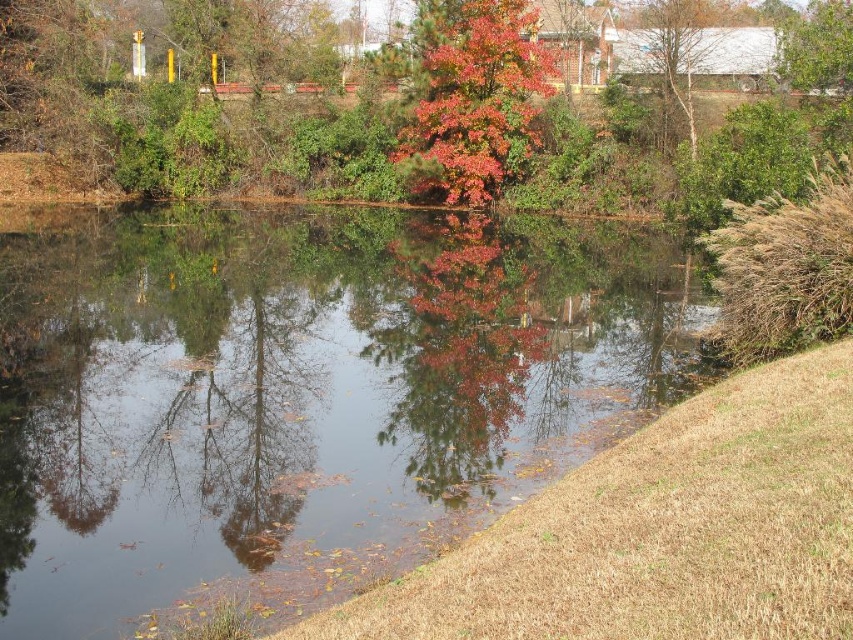
Is shiny red leaves at center shorter than bare branches at upper right?

Yes, shiny red leaves at center is shorter than bare branches at upper right.

Can you confirm if shiny red leaves at center is bigger than bare branches at upper right?

Yes.

Describe the element at coordinates (474, 97) in the screenshot. I see `shiny red leaves at center` at that location.

At what (x,y) coordinates should I click in order to perform the action: click on shiny red leaves at center. Please return your answer as a coordinate pair (x, y). Looking at the image, I should click on (474, 97).

Is transparent water at center wider than autumn leaves at center?

No.

Which is above, transparent water at center or autumn leaves at center?

autumn leaves at center is higher up.

Where is `transparent water at center`? transparent water at center is located at coordinates coord(306,392).

What do you see at coordinates (306, 392) in the screenshot? I see `transparent water at center` at bounding box center [306, 392].

Measure the distance between transparent water at center and camera.

The distance of transparent water at center from camera is 23.68 feet.

Which is behind, point (247, 273) or point (485, 177)?

Point (485, 177)

Where is `transparent water at center`? Image resolution: width=853 pixels, height=640 pixels. transparent water at center is located at coordinates (306, 392).